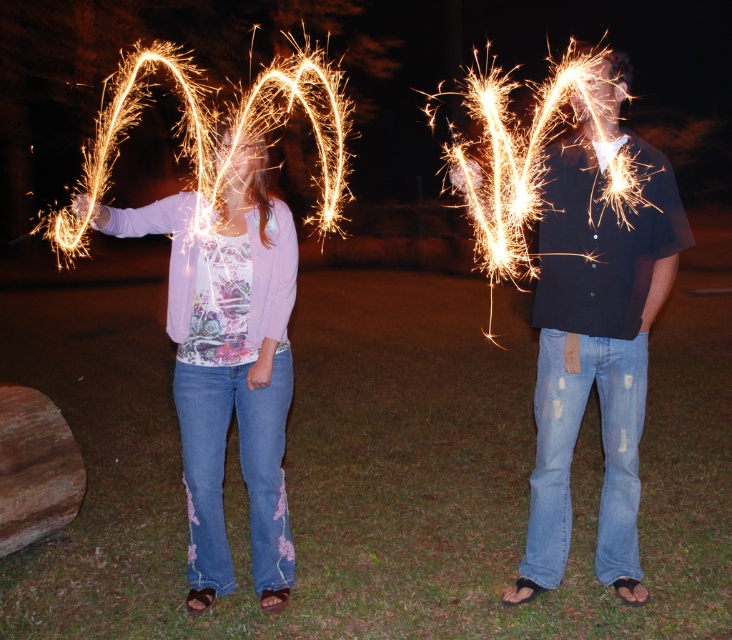
You are an observer standing in front of the two individuals holding sparklers. You notice both the matte black shirt at center and the matte pink sweater at center. Which clothing item is covering part of the other?

The matte black shirt at center is positioned over the matte pink sweater at center, so it is covering part of it.

You are standing at the origin point of the coordinate system. You see two points in the image, point (x=597, y=116) and point (x=274, y=230). Which point is closer to you?

Point (x=597, y=116) is in front of point (x=274, y=230), so it is closer to you.